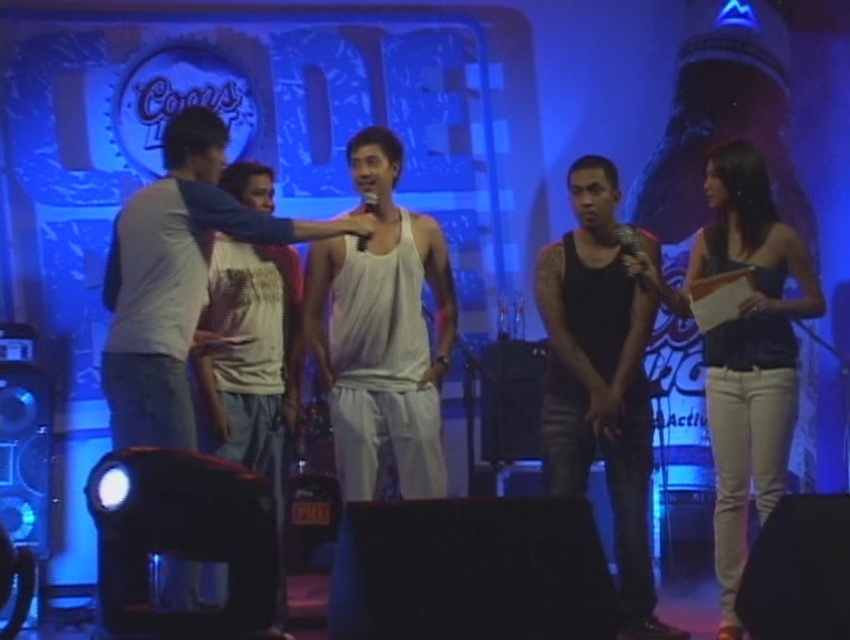
You are a costume designer preparing for a play. You have two tank tops available for the lead actor. The white matte tank top at center and the black matte tank top at center. The actor prefers a longer tank top. Which one should you choose?

The black matte tank top at center is longer than the white matte tank top at center, so you should choose the black matte tank top at center.

You are a photographer trying to capture a clear shot of the white matte tank top at center and the black matte tank top at center. Since the stage lighting is dim, you need to adjust your camera settings. Which tank top might be easier to capture clearly due to its color and position?

The white matte tank top at center is positioned over the black matte tank top at center. Since white reflects more light, it might be easier to capture clearly in the dim lighting compared to the black one which absorbs more light.

You are a photographer trying to capture a closeup of the person holding the microphone in the foreground. You notice two points marked in the scene at coordinates point (188, 337) and point (256, 333). Which point should you focus on to ensure the subject is in focus?

Point (188, 337) is closer to the camera than point (256, 333), so focusing on point (188, 337) will ensure the subject holding the microphone is in focus.